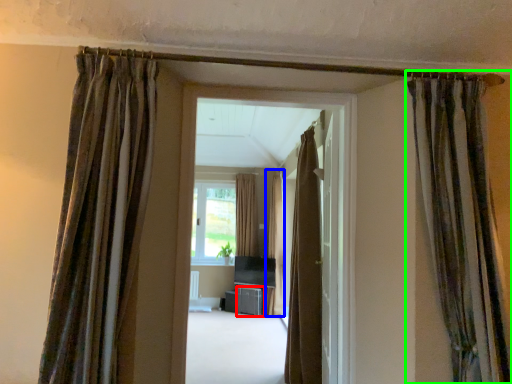
Question: Which is nearer to the furniture (highlighted by a red box)? curtain (highlighted by a blue box) or curtain (highlighted by a green box).

Choices:
 (A) curtain
 (B) curtain

Answer: (A)